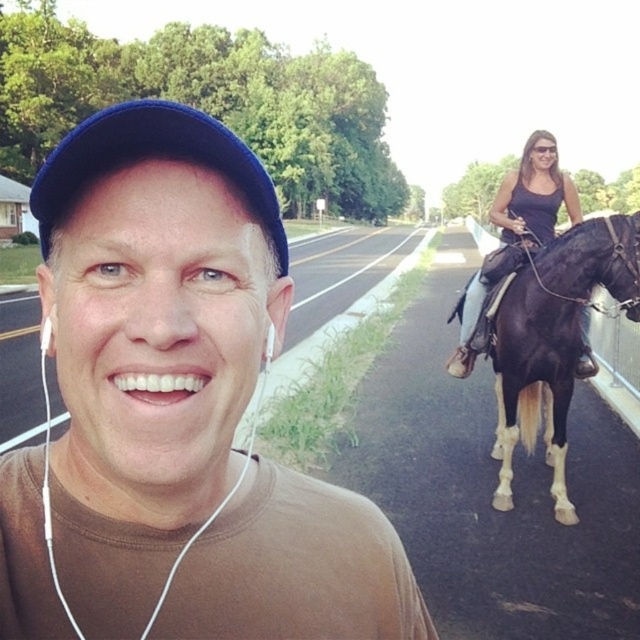
Measure the distance between brown matte t-shirt at center and camera.

brown matte t-shirt at center and camera are 18.23 inches apart from each other.

Is point (253, 627) in front of point (268, 218)?

No, (253, 627) is further to viewer.

Image resolution: width=640 pixels, height=640 pixels. I want to click on brown matte t-shirt at center, so click(x=176, y=412).

Is point (140, 124) positioned behind point (528, 221)?

That is False.

Which is more to the right, blue fabric baseball cap at upper center or black satin dress at upper right?

Positioned to the right is black satin dress at upper right.

Describe the element at coordinates (150, 157) in the screenshot. I see `blue fabric baseball cap at upper center` at that location.

You are a GUI agent. You are given a task and a screenshot of the screen. Output one action in this format:
    pyautogui.click(x=<x>, y=<y>)
    Task: Click on the blue fabric baseball cap at upper center
    The height and width of the screenshot is (640, 640).
    Given the screenshot: What is the action you would take?
    pyautogui.click(x=150, y=157)

Does black glossy horse at right appear under black satin dress at upper right?

Correct, black glossy horse at right is located below black satin dress at upper right.

Is black glossy horse at right positioned in front of black satin dress at upper right?

Yes, black glossy horse at right is in front of black satin dress at upper right.

This screenshot has height=640, width=640. I want to click on black glossy horse at right, so click(554, 340).